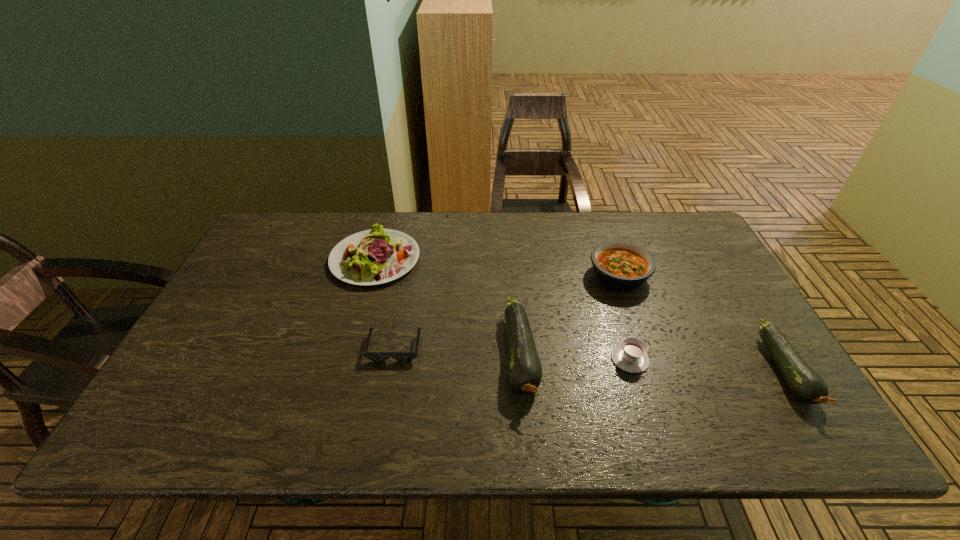
Identify the location of free region at the left edge. This screenshot has height=540, width=960. (239, 367).

Where is `free space at the right edge of the desktop`? The width and height of the screenshot is (960, 540). free space at the right edge of the desktop is located at coordinates [x=717, y=295].

What are the coordinates of `free space between the salad plate and the taller zucchini` in the screenshot? It's located at point(448,307).

Find the location of a particular element. This screenshot has height=540, width=960. free space between the stew and the second shortest object is located at coordinates (624, 317).

You are a GUI agent. You are given a task and a screenshot of the screen. Output one action in this format:
    pyautogui.click(x=<x>, y=<y>)
    Task: Click on the vacant area that lies between the stew and the fifth tallest object
    The height and width of the screenshot is (540, 960).
    Given the screenshot: What is the action you would take?
    pyautogui.click(x=624, y=317)

This screenshot has height=540, width=960. In order to click on empty space that is in between the tallest object and the second shortest object in this screenshot , I will do `click(575, 357)`.

The height and width of the screenshot is (540, 960). Identify the location of vacant space that's between the taller zucchini and the salad plate. (448, 307).

At what (x,y) coordinates should I click in order to perform the action: click on free space that is in between the tallest object and the teacup. Please return your answer as a coordinate pair (x, y). Looking at the image, I should click on (575, 357).

At what (x,y) coordinates should I click in order to perform the action: click on free space between the second shortest object and the tallest object. Please return your answer as a coordinate pair (x, y). The width and height of the screenshot is (960, 540). Looking at the image, I should click on (575, 357).

Where is `vacant space that is in between the tallest object and the shortest object`? vacant space that is in between the tallest object and the shortest object is located at coordinates (458, 352).